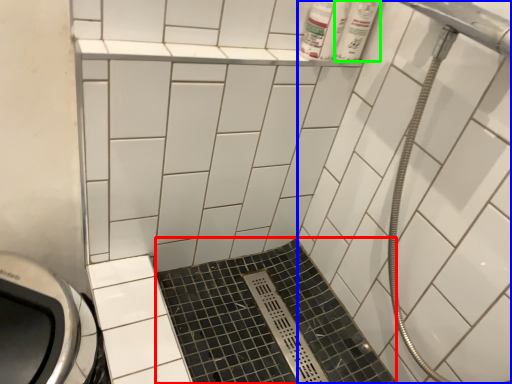
Question: Based on their relative distances, which object is farther from ceramic tile (highlighted by a red box)? Choose from bath (highlighted by a blue box) and toiletry (highlighted by a green box).

Choices:
 (A) bath
 (B) toiletry

Answer: (B)